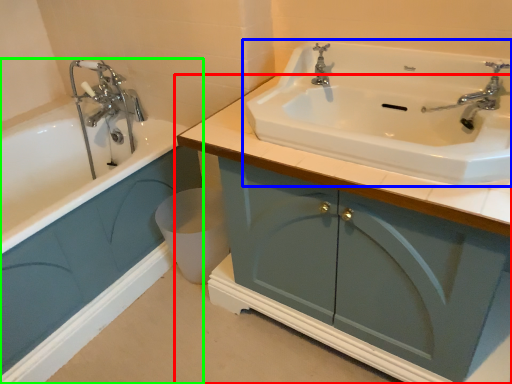
Question: Considering the real-world distances, which object is closest to bathroom cabinet (highlighted by a red box)? sink (highlighted by a blue box) or bathroom cabinet (highlighted by a green box).

Choices:
 (A) sink
 (B) bathroom cabinet

Answer: (A)